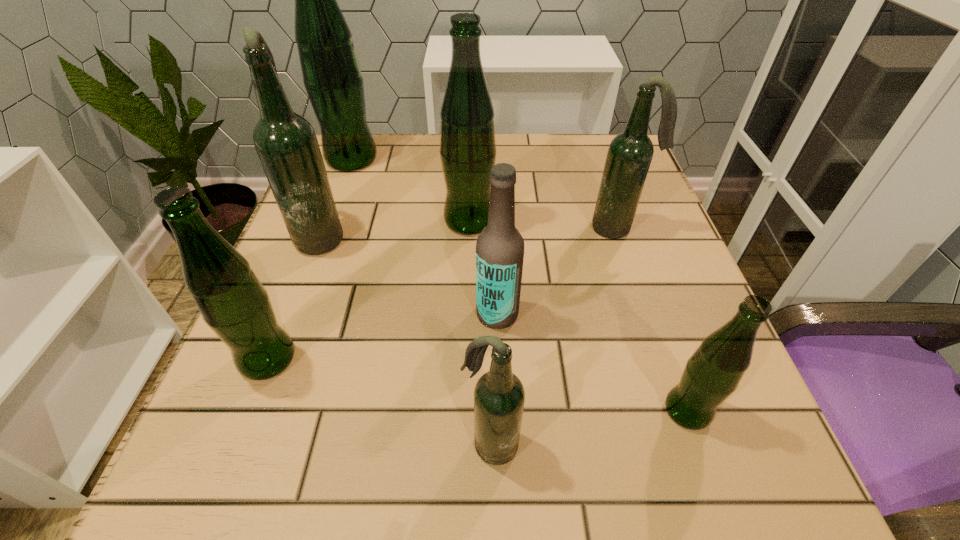
The width and height of the screenshot is (960, 540). What are the coordinates of `the nearest green beer bottle` in the screenshot? It's located at (713, 372).

Where is `the second dark beer bottle from right to left`? The width and height of the screenshot is (960, 540). the second dark beer bottle from right to left is located at coordinates (499, 396).

Image resolution: width=960 pixels, height=540 pixels. Identify the location of the smallest dark beer bottle. (499, 396).

At what (x,y) coordinates should I click in order to perform the action: click on blank space located on the front of the farthest object. Please return your answer as a coordinate pair (x, y). Image resolution: width=960 pixels, height=540 pixels. Looking at the image, I should click on (340, 191).

Where is `free space located on the right of the third green beer bottle from left to right`? The image size is (960, 540). free space located on the right of the third green beer bottle from left to right is located at coordinates (628, 221).

Image resolution: width=960 pixels, height=540 pixels. What are the coordinates of `vacant region located on the right of the biggest dark beer bottle` in the screenshot? It's located at 452,235.

Where is `free location located 0.090m on the back of the rightmost dark beer bottle`? The image size is (960, 540). free location located 0.090m on the back of the rightmost dark beer bottle is located at coordinates (605, 191).

Image resolution: width=960 pixels, height=540 pixels. Identify the location of vacant space located 0.320m on the right of the second smallest green beer bottle. (507, 359).

Find the location of a particular element. blank area located 0.240m on the label of the fifth farthest beer bottle is located at coordinates (331, 314).

Where is `blank space located 0.330m on the label of the fifth farthest beer bottle`? This screenshot has width=960, height=540. blank space located 0.330m on the label of the fifth farthest beer bottle is located at coordinates (276, 314).